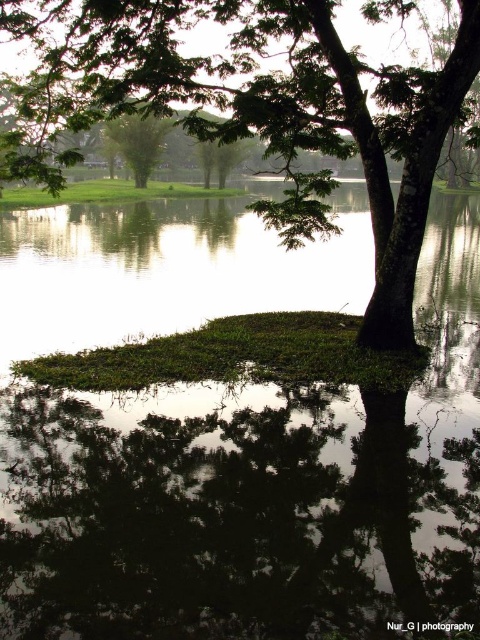
You are an environmental scientist assessing the biodiversity of this area. You observe the green leafy tree at center and the green leafy tree at upper left. Which tree would likely cast a larger shadow during midday, and why?

The green leafy tree at center would cast a larger shadow during midday because it has a larger size compared to the green leafy tree at upper left.

You are an environmental scientist analyzing the image of the serene natural scene. You need to determine which tree has a wider spread in the foreground. Which tree between the green leafy tree at center and the green leafy tree at upper left has a larger width?

The green leafy tree at center has a larger width compared to the green leafy tree at upper left.